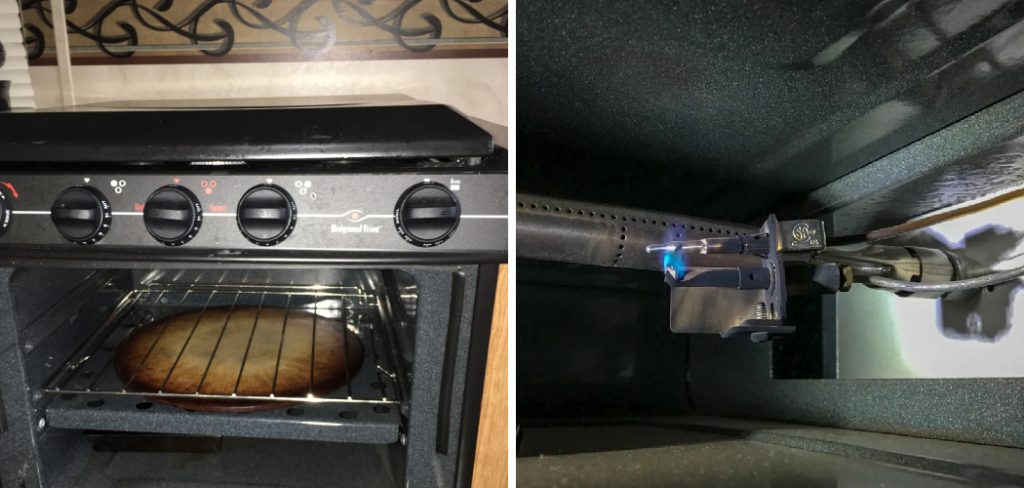
Find the location of a particular element. The height and width of the screenshot is (488, 1024). gray oven is located at coordinates (302, 441).